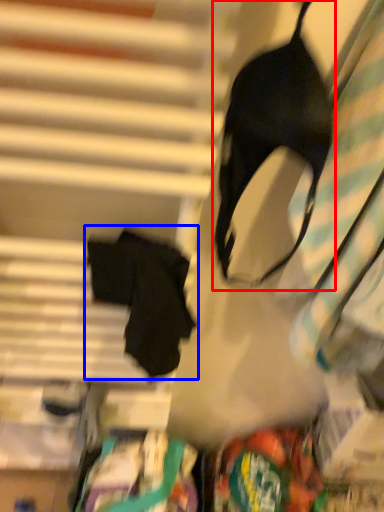
Question: Which point is closer to the camera, brassiere (highlighted by a red box) or robe (highlighted by a blue box)?

Choices:
 (A) brassiere
 (B) robe

Answer: (A)